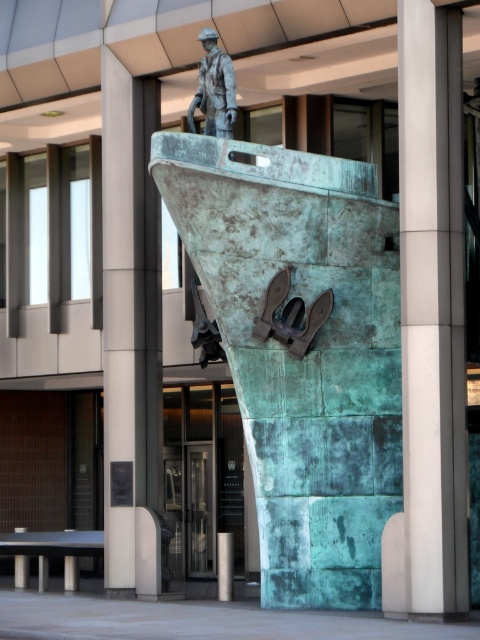
Based on the provided scene description, where is the smooth gray concrete pillar at center located in the image?

The smooth gray concrete pillar at center is located at point (x=430, y=324).

Consider the image. You are an architect evaluating the sculpture garden. You need to determine which object is taller between the smooth gray concrete pillar at center and the bronze statue at upper center. Based on the scene, which one is taller?

The bronze statue at upper center is taller than the smooth gray concrete pillar at center.

You are an architect reviewing the sculpture layout. The smooth gray concrete pillar at center and the bronze statue at upper center are part of the design. Which object has a larger width measurement?

The bronze statue at upper center has a larger width than the smooth gray concrete pillar at center, as the smooth gray concrete pillar at center is thinner than the bronze statue at upper center.